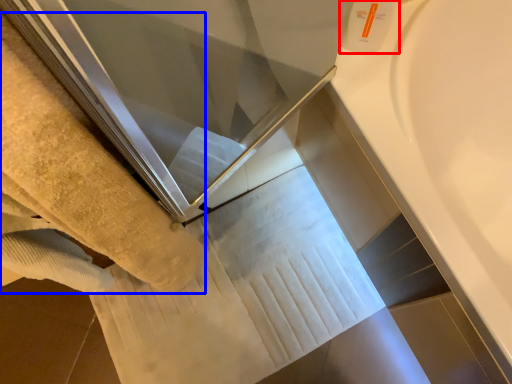
Question: Which of the following is the closest to the observer, toiletry (highlighted by a red box) or towel (highlighted by a blue box)?

Choices:
 (A) toiletry
 (B) towel

Answer: (B)